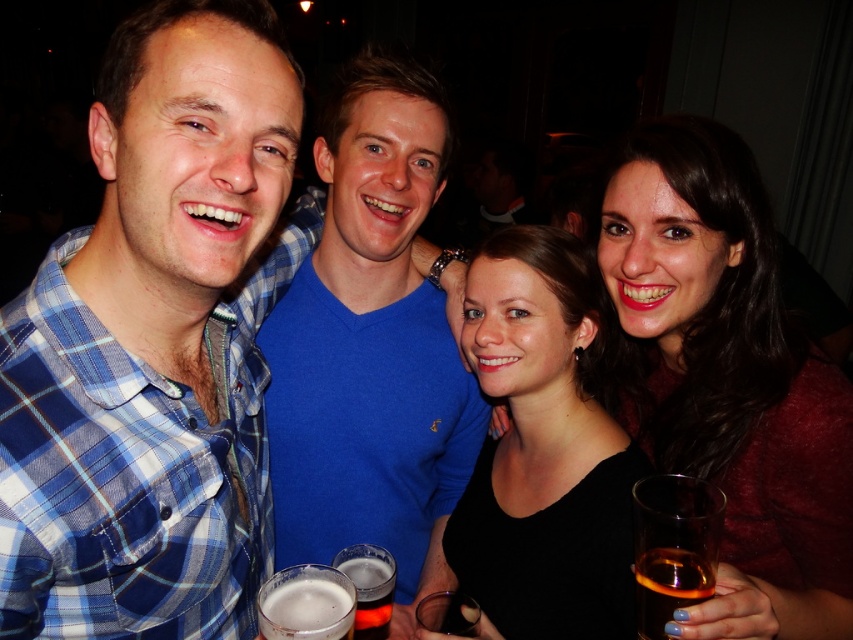
Which is in front, point (331, 566) or point (654, 588)?

Point (654, 588) is in front.

Is foamy glass at lower left to the left of amber liquid glass at lower right from the viewer's perspective?

Indeed, foamy glass at lower left is positioned on the left side of amber liquid glass at lower right.

Identify the location of foamy glass at lower left. (306, 604).

The width and height of the screenshot is (853, 640). Find the location of `foamy glass at lower left`. foamy glass at lower left is located at coordinates (306, 604).

Can you confirm if blue cotton shirt at center is shorter than amber liquid glass at lower right?

No.

Can you confirm if blue cotton shirt at center is taller than amber liquid glass at lower right?

Yes.

Is point (439, 349) positioned after point (692, 588)?

Yes, point (439, 349) is farther from viewer.

Identify the location of blue cotton shirt at center. The width and height of the screenshot is (853, 640). (372, 346).

Can you confirm if blue plaid shirt at center is positioned above amber liquid glass at lower right?

Yes, blue plaid shirt at center is above amber liquid glass at lower right.

Does point (224, 582) come in front of point (674, 596)?

No, (224, 582) is behind (674, 596).

Which is in front, point (107, 65) or point (637, 561)?

Point (107, 65)

Locate an element on the screen. The height and width of the screenshot is (640, 853). blue plaid shirt at center is located at coordinates (155, 342).